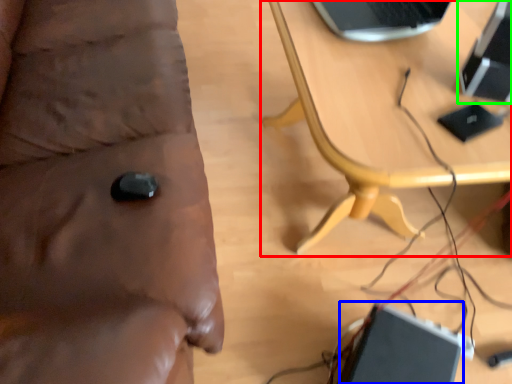
Question: Which object is the farthest from table (highlighted by a red box)? Choose among these: laptop (highlighted by a blue box) or computer (highlighted by a green box).

Choices:
 (A) laptop
 (B) computer

Answer: (A)